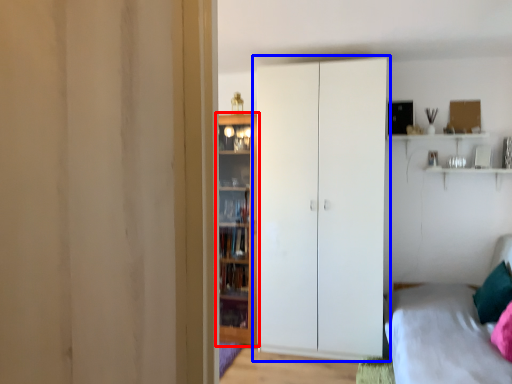
Question: Among these objects, which one is farthest to the camera, door (highlighted by a red box) or cupboard (highlighted by a blue box)?

Choices:
 (A) door
 (B) cupboard

Answer: (A)